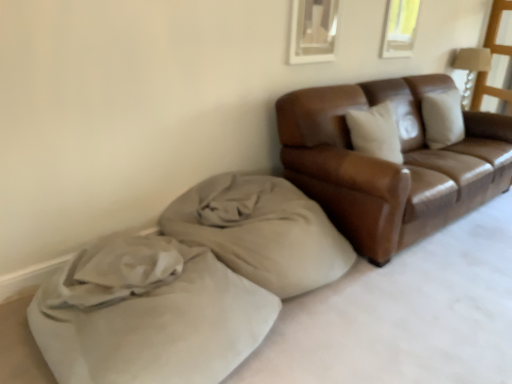
Question: Based on their sizes in the image, would you say matte brown wooden lamp at upper right is bigger or smaller than brown leather couch at right?

Choices:
 (A) small
 (B) big

Answer: (A)

Question: Which is correct: matte brown wooden lamp at upper right is inside brown leather couch at right, or outside of it?

Choices:
 (A) outside
 (B) inside

Answer: (A)

Question: Estimate the real-world distances between objects in this image. Which object is closer to the beige suede bean bag at lower left?

Choices:
 (A) beige fabric cushion at lower left
 (B) brown leather couch at right
 (C) transparent plastic window screen at upper right
 (D) matte brown wooden lamp at upper right

Answer: (A)

Question: Estimate the real-world distances between objects in this image. Which object is closer to the beige suede bean bag at lower left?

Choices:
 (A) matte brown wooden lamp at upper right
 (B) transparent plastic window screen at upper right
 (C) beige fabric cushion at lower left
 (D) brown leather couch at right

Answer: (C)